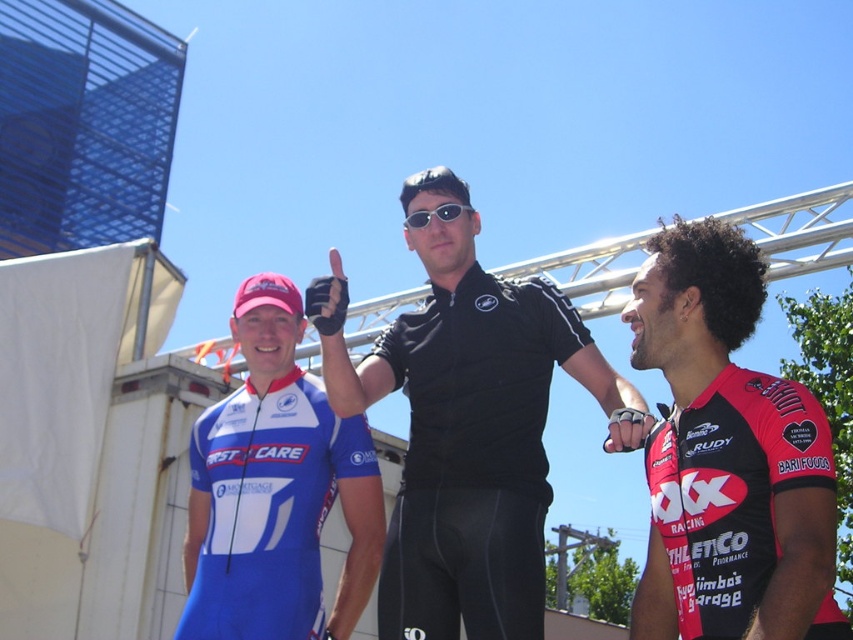
What do you see at coordinates (727, 458) in the screenshot? This screenshot has width=853, height=640. I see `red matte jersey at right` at bounding box center [727, 458].

Is point (747, 300) farther from viewer compared to point (421, 214)?

That is False.

The image size is (853, 640). In order to click on red matte jersey at right in this screenshot , I will do `click(727, 458)`.

Is point (277, 604) positioned after point (456, 204)?

No, it is in front of (456, 204).

Find the location of a particular element. The image size is (853, 640). blue jersey at center is located at coordinates (276, 490).

The width and height of the screenshot is (853, 640). In order to click on blue jersey at center in this screenshot , I will do `click(276, 490)`.

Is red matte jersey at right positioned in front of blue jersey at center?

Yes, it is.

Which of these two, red matte jersey at right or blue jersey at center, stands taller?

red matte jersey at right is taller.

Describe the element at coordinates (727, 458) in the screenshot. I see `red matte jersey at right` at that location.

This screenshot has height=640, width=853. Identify the location of red matte jersey at right. (727, 458).